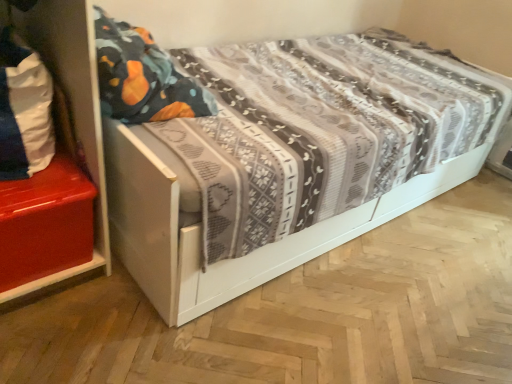
Question: From a real-world perspective, is white wood bed at center positioned above or below white fabric pillow at left?

Choices:
 (A) above
 (B) below

Answer: (B)

Question: From the image's perspective, relative to white fabric pillow at left, is white wood bed at center above or below?

Choices:
 (A) below
 (B) above

Answer: (A)

Question: Which object is the closest to the shiny red chest at left?

Choices:
 (A) white wood bed at center
 (B) white fabric pillow at left

Answer: (B)

Question: Estimate the real-world distances between objects in this image. Which object is closer to the white wood bed at center?

Choices:
 (A) white fabric pillow at left
 (B) shiny red chest at left

Answer: (A)